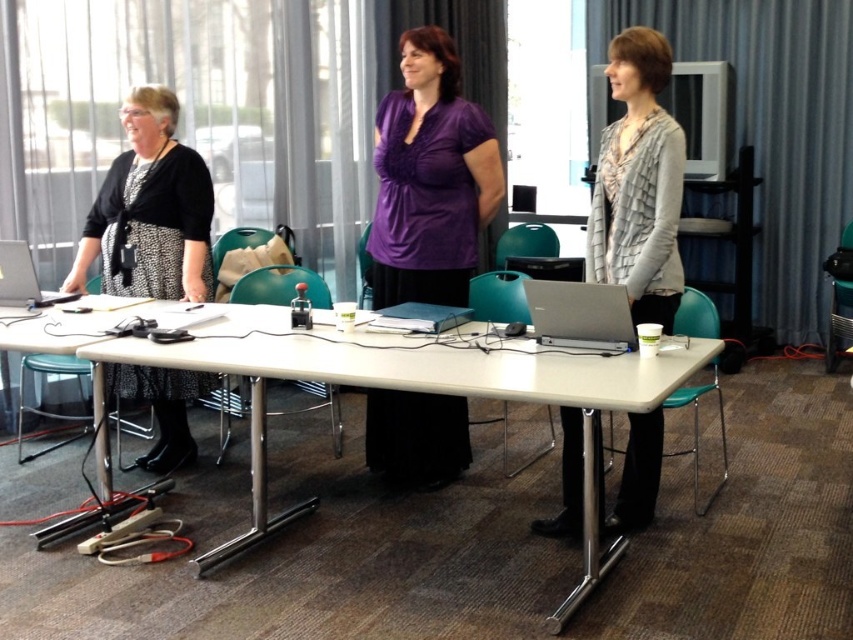
Is point (631, 163) positioned behind point (148, 116)?

No, (631, 163) is in front of (148, 116).

Can you confirm if gray textured sweater at center is positioned to the left of black dotted dress at left?

No, gray textured sweater at center is not to the left of black dotted dress at left.

Find the location of a particular element. The width and height of the screenshot is (853, 640). gray textured sweater at center is located at coordinates (637, 182).

Does black dotted dress at left lie behind silver metallic laptop at left?

Yes, it is behind silver metallic laptop at left.

Who is more forward, (192, 166) or (68, 296)?

Positioned in front is point (192, 166).

Locate an element on the screen. This screenshot has width=853, height=640. black dotted dress at left is located at coordinates (149, 209).

Does gray textured sweater at center come behind silver metallic laptop at center?

Yes, it is.

Identify the location of gray textured sweater at center. This screenshot has height=640, width=853. (637, 182).

Locate an element on the screen. Image resolution: width=853 pixels, height=640 pixels. gray textured sweater at center is located at coordinates (637, 182).